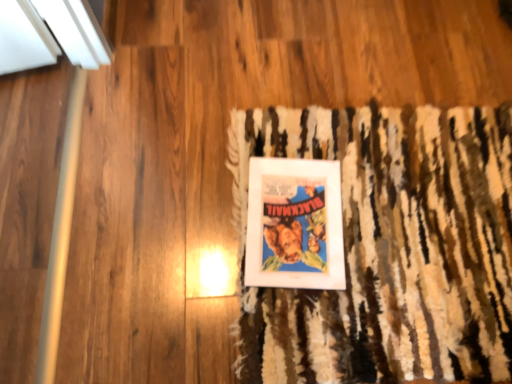
Describe the element at coordinates (389, 247) in the screenshot. I see `textured brown doormat at center` at that location.

From the picture: Measure the distance between textured brown doormat at center and camera.

The distance of textured brown doormat at center from camera is 33.09 inches.

Looking at this image, what is the approximate width of textured brown doormat at center?

textured brown doormat at center is 62.11 centimeters wide.

Where is `textured brown doormat at center`? textured brown doormat at center is located at coordinates (389, 247).

This screenshot has width=512, height=384. In order to click on matte paper poster at center in this screenshot , I will do `click(294, 225)`.

In the scene shown: What is the approximate width of matte paper poster at center?

The width of matte paper poster at center is 12.09 inches.

Describe the element at coordinates (294, 225) in the screenshot. I see `matte paper poster at center` at that location.

Measure the distance between point (294, 215) and camera.

The depth of point (294, 215) is 37.44 inches.

Locate an element on the screen. textured brown doormat at center is located at coordinates (389, 247).

Considering the positions of objects textured brown doormat at center and matte paper poster at center in the image provided, who is more to the left, textured brown doormat at center or matte paper poster at center?

From the viewer's perspective, matte paper poster at center appears more on the left side.

From the picture: Is textured brown doormat at center in front of or behind matte paper poster at center in the image?

In the image, textured brown doormat at center appears in front of matte paper poster at center.

Is point (322, 322) positioned after point (274, 220)?

No.

From the image's perspective, is textured brown doormat at center under matte paper poster at center?

Indeed, from the image's perspective, textured brown doormat at center is shown beneath matte paper poster at center.

Consider the image. From a real-world perspective, does textured brown doormat at center stand above matte paper poster at center?

Yes, from a real-world perspective, textured brown doormat at center is on top of matte paper poster at center.

Which of these two, textured brown doormat at center or matte paper poster at center, is thinner?

With smaller width is matte paper poster at center.

Who is taller, textured brown doormat at center or matte paper poster at center?

matte paper poster at center is taller.

Considering the sizes of objects textured brown doormat at center and matte paper poster at center in the image provided, who is bigger, textured brown doormat at center or matte paper poster at center?

Bigger between the two is textured brown doormat at center.

In the scene shown: Which is correct: textured brown doormat at center is inside matte paper poster at center, or outside of it?

textured brown doormat at center is outside matte paper poster at center.

Is textured brown doormat at center not close to matte paper poster at center?

No, textured brown doormat at center is not far away from matte paper poster at center.

Looking at this image, is textured brown doormat at center oriented away from matte paper poster at center?

textured brown doormat at center does not have its back to matte paper poster at center.

Measure the distance from textured brown doormat at center to matte paper poster at center.

A distance of 5.11 inches exists between textured brown doormat at center and matte paper poster at center.

This screenshot has width=512, height=384. I want to click on picture frame that is above the textured brown doormat at center (from the image's perspective), so click(x=294, y=225).

Considering the relative positions of matte paper poster at center and textured brown doormat at center in the image provided, is matte paper poster at center to the left or to the right of textured brown doormat at center?

matte paper poster at center is positioned on textured brown doormat at center's left side.

Is matte paper poster at center positioned behind textured brown doormat at center?

That is True.

Which point is more forward, (x=312, y=216) or (x=502, y=130)?

The point (x=312, y=216) is in front.

From the image's perspective, is matte paper poster at center positioned above or below textured brown doormat at center?

matte paper poster at center is above textured brown doormat at center.

From a real-world perspective, relative to textured brown doormat at center, is matte paper poster at center vertically above or below?

matte paper poster at center is below textured brown doormat at center.

Can you confirm if matte paper poster at center is thinner than textured brown doormat at center?

Indeed, matte paper poster at center has a lesser width compared to textured brown doormat at center.

In the scene shown: Is matte paper poster at center taller or shorter than textured brown doormat at center?

matte paper poster at center is taller than textured brown doormat at center.

Between matte paper poster at center and textured brown doormat at center, which one has smaller size?

Smaller between the two is matte paper poster at center.

From the picture: Is matte paper poster at center inside the boundaries of textured brown doormat at center, or outside?

matte paper poster at center is inside textured brown doormat at center.

Are matte paper poster at center and textured brown doormat at center making contact?

matte paper poster at center is not next to textured brown doormat at center, and they're not touching.

Is matte paper poster at center oriented towards textured brown doormat at center?

Yes, matte paper poster at center is aimed at textured brown doormat at center.

Can you tell me how much matte paper poster at center and textured brown doormat at center differ in facing direction?

There is a 4.78-degree angle between the facing directions of matte paper poster at center and textured brown doormat at center.

The width and height of the screenshot is (512, 384). In order to click on doormat below the matte paper poster at center (from the image's perspective) in this screenshot , I will do `click(389, 247)`.

This screenshot has height=384, width=512. Find the location of `picture frame on the left of textured brown doormat at center`. picture frame on the left of textured brown doormat at center is located at coordinates (294, 225).

Where is `doormat in front of the matte paper poster at center`? doormat in front of the matte paper poster at center is located at coordinates (389, 247).